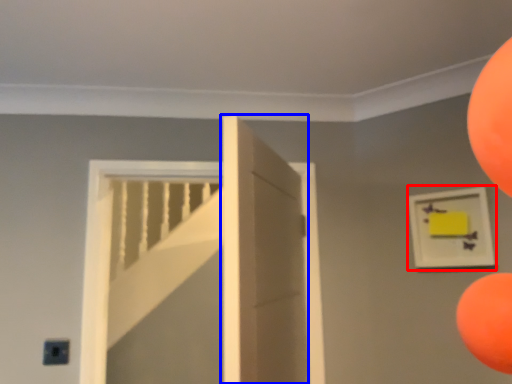
Question: Which object is further to the camera taking this photo, picture frame (highlighted by a red box) or door (highlighted by a blue box)?

Choices:
 (A) picture frame
 (B) door

Answer: (A)